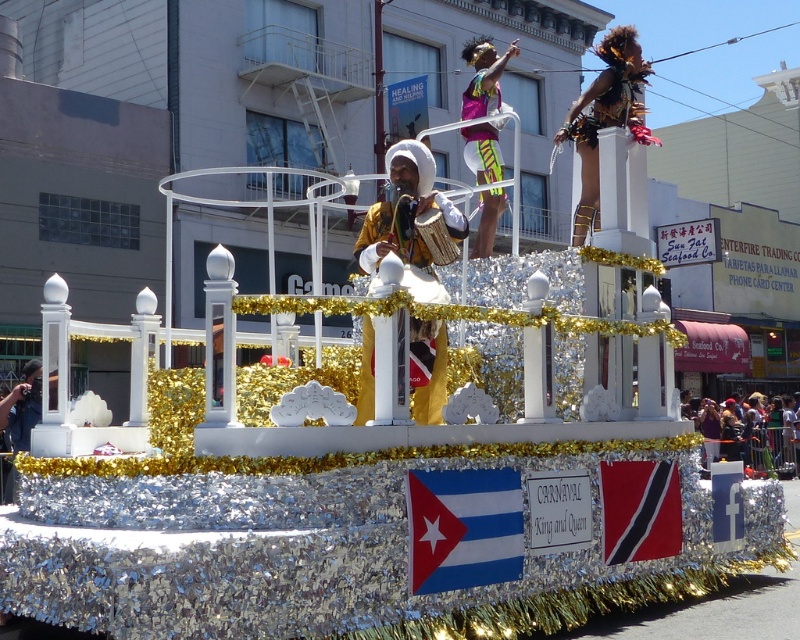
You are a spectator at the Carnival parade and notice two colorful fabrics on the float. The first is a matte gold robe at center and the second is a neon yellow fabric at center. From your perspective, which fabric is positioned to the left?

The matte gold robe at center is positioned to the left of the neon yellow fabric at center.